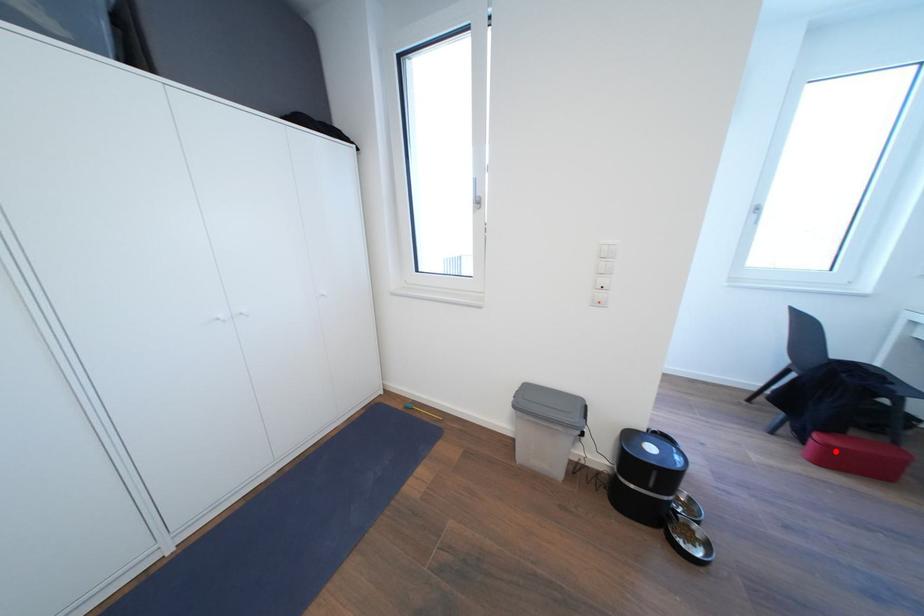
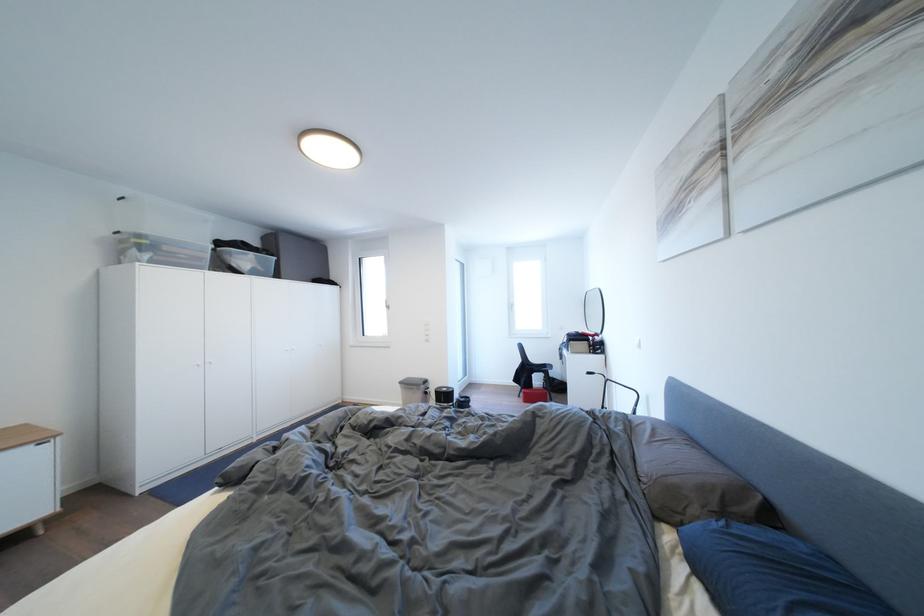
Question: I am providing you with two images of the same scene from different viewpoints. A red point is shown in image1. For the corresponding object point in image2, is it positioned nearer or farther from the camera?

Choices:
 (A) Nearer
 (B) Farther

Answer: (B)